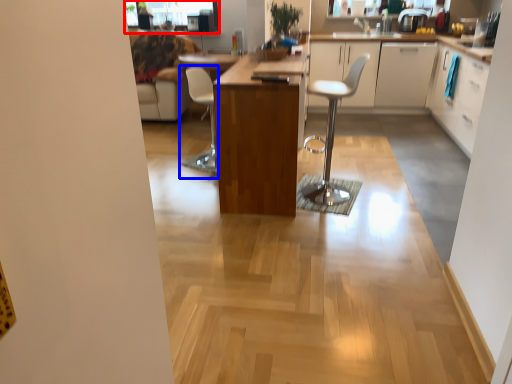
Question: Which point is further to the camera, window screen (highlighted by a red box) or chair (highlighted by a blue box)?

Choices:
 (A) window screen
 (B) chair

Answer: (A)